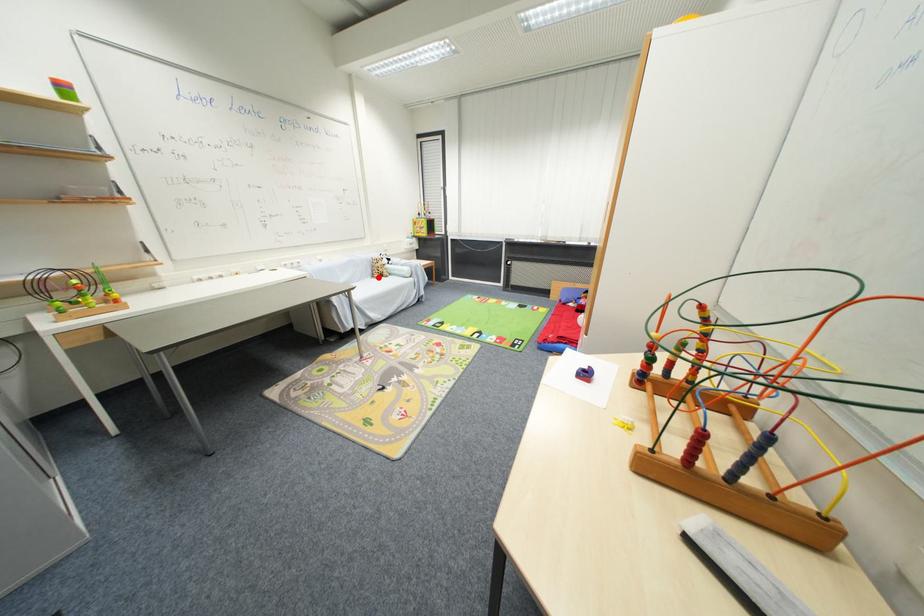
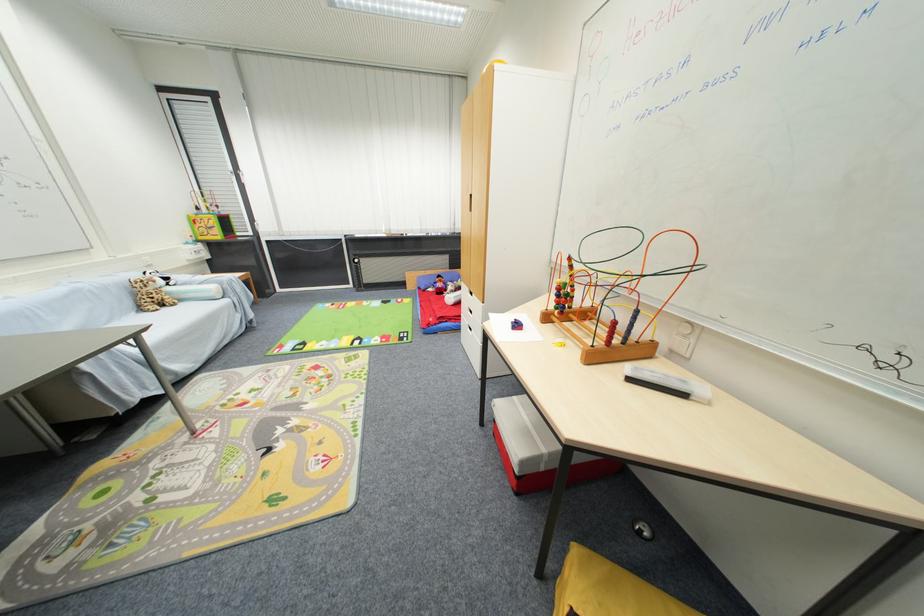
Question: I am providing you with two images of the same scene from different viewpoints. Given a red point in image1, look at the same physical point in image2. Is it:

Choices:
 (A) Closer to the viewpoint
 (B) Farther from the viewpoint

Answer: (B)